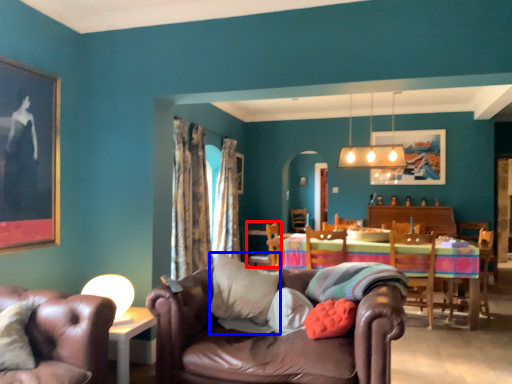
Question: Which of the following is the farthest to the observer, chair (highlighted by a red box) or pillow (highlighted by a blue box)?

Choices:
 (A) chair
 (B) pillow

Answer: (A)